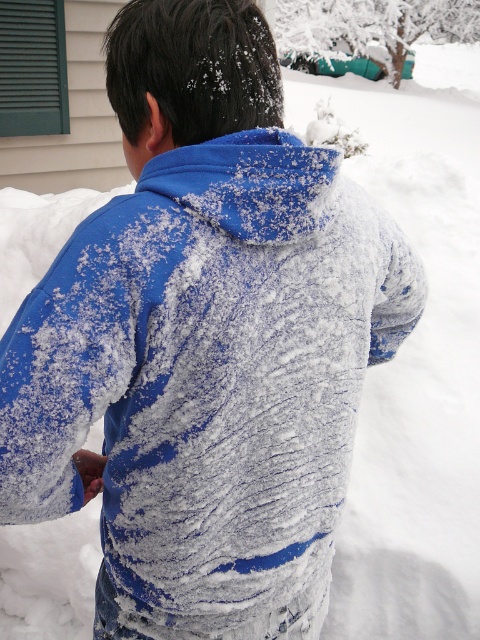
Question: Which object is closer to the camera taking this photo?

Choices:
 (A) blue fleece jacket at center
 (B) white fluffy snowman at upper center

Answer: (A)

Question: Which of the following is the farthest from the observer?

Choices:
 (A) (130, 307)
 (B) (327, 125)

Answer: (B)

Question: Does blue fleece jacket at center appear on the left side of white fluffy snowman at upper center?

Choices:
 (A) no
 (B) yes

Answer: (B)

Question: Which point is farther from the camera taking this photo?

Choices:
 (A) (360, 145)
 (B) (346, 179)

Answer: (A)

Question: Can you confirm if blue fleece jacket at center is smaller than white fluffy snowman at upper center?

Choices:
 (A) no
 (B) yes

Answer: (B)

Question: Where is blue fleece jacket at center located in relation to white fluffy snowman at upper center in the image?

Choices:
 (A) left
 (B) right

Answer: (A)